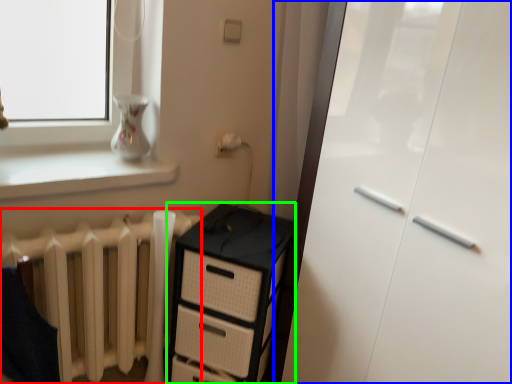
Question: Estimate the real-world distances between objects in this image. Which object is farther from radiator (highlighted by a red box), screen door (highlighted by a blue box) or chest of drawers (highlighted by a green box)?

Choices:
 (A) screen door
 (B) chest of drawers

Answer: (A)